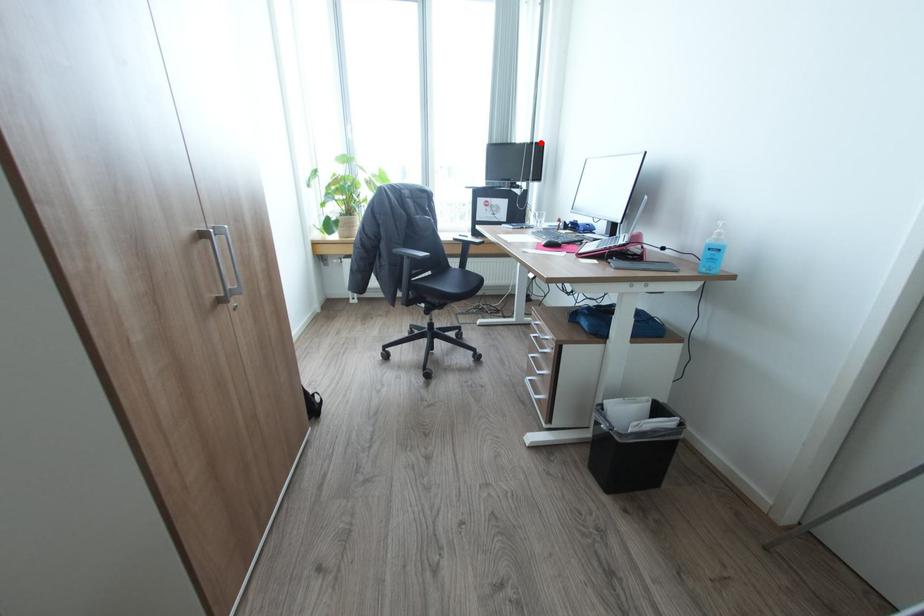
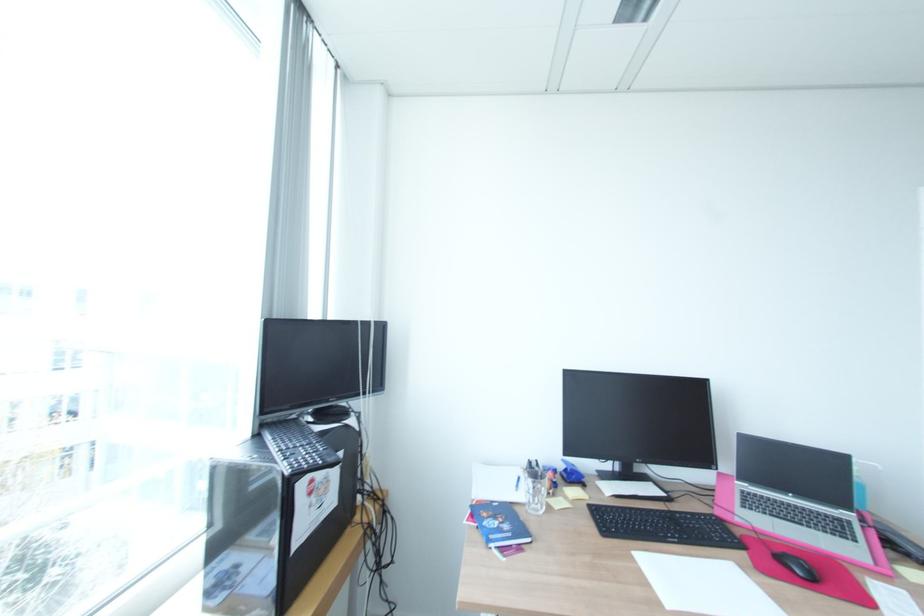
Question: A red point is marked in image1. In image2, is the corresponding 3D point closer to the camera or farther? Reply with the corresponding letter.

Choices:
 (A) The corresponding 3D point is closer.
 (B) The corresponding 3D point is farther.

Answer: (B)